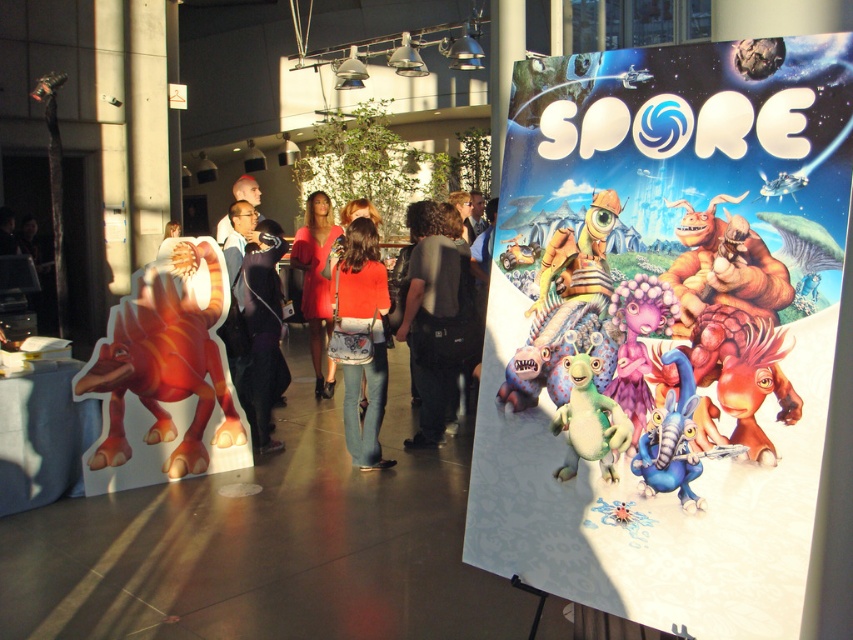
You are a game attendee standing at the entrance of the Spore promotional display. You see a matte orange shirt at center and a purple matte alien at center. If you want to touch both items, which one would you need to walk further to reach after touching the first one?

The distance between the matte orange shirt at center and the purple matte alien at center is 3.52 meters. Since you have to touch both items, you will need to walk 3.52 meters after touching one to reach the other, so whichever you touch first, the second one will require walking further.

You are a photographer setting up a shoot in the Spore promotional display. You need to position a camera so it can capture both the orange fabric dress at center and the rubberized brown creature at center in the same frame. Based on their sizes, which object should you focus on to ensure both fit comfortably in the shot?

The orange fabric dress at center might be wider than the rubberized brown creature at center, so focusing on the orange fabric dress at center would ensure both fit comfortably in the shot since it is likely the wider object.